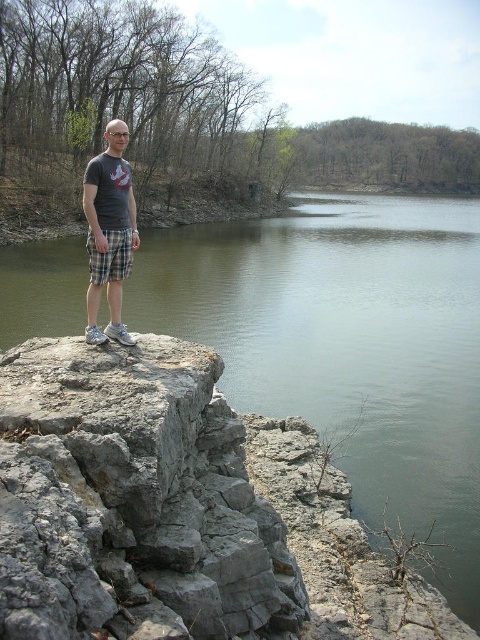
Question: Which point is farther to the camera?

Choices:
 (A) greenish-gray water at center
 (B) gray rough rock at center

Answer: (A)

Question: Is gray rough rock at center positioned before matte gray t-shirt at center?

Choices:
 (A) yes
 (B) no

Answer: (A)

Question: Does gray rough rock at center appear on the right side of matte gray t-shirt at center?

Choices:
 (A) yes
 (B) no

Answer: (A)

Question: Considering the relative positions of greenish-gray water at center and gray rough rock at center in the image provided, where is greenish-gray water at center located with respect to gray rough rock at center?

Choices:
 (A) below
 (B) above

Answer: (B)

Question: Which of these objects is positioned closest to the gray rough rock at center?

Choices:
 (A) greenish-gray water at center
 (B) matte gray t-shirt at center

Answer: (B)

Question: Which is nearer to the gray rough rock at center?

Choices:
 (A) greenish-gray water at center
 (B) matte gray t-shirt at center

Answer: (B)